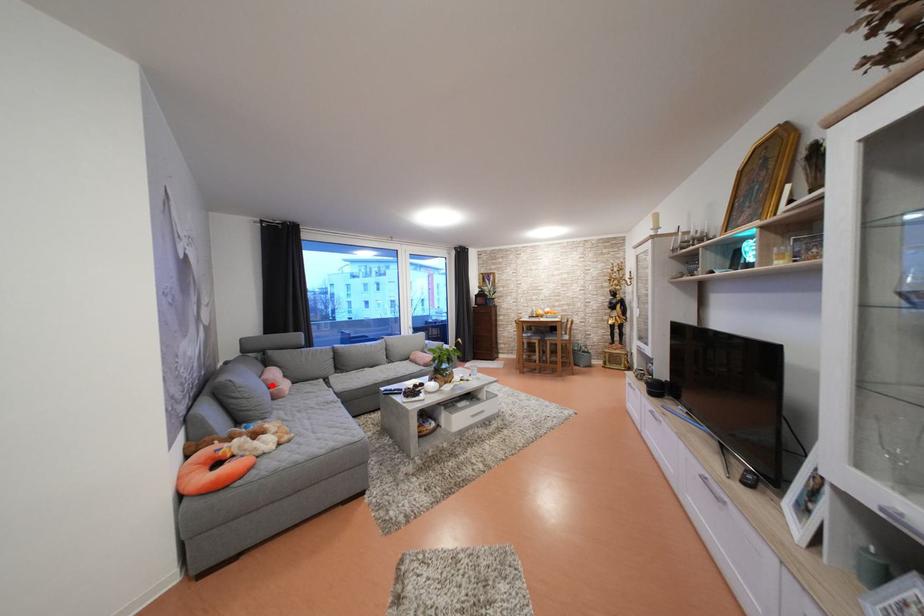
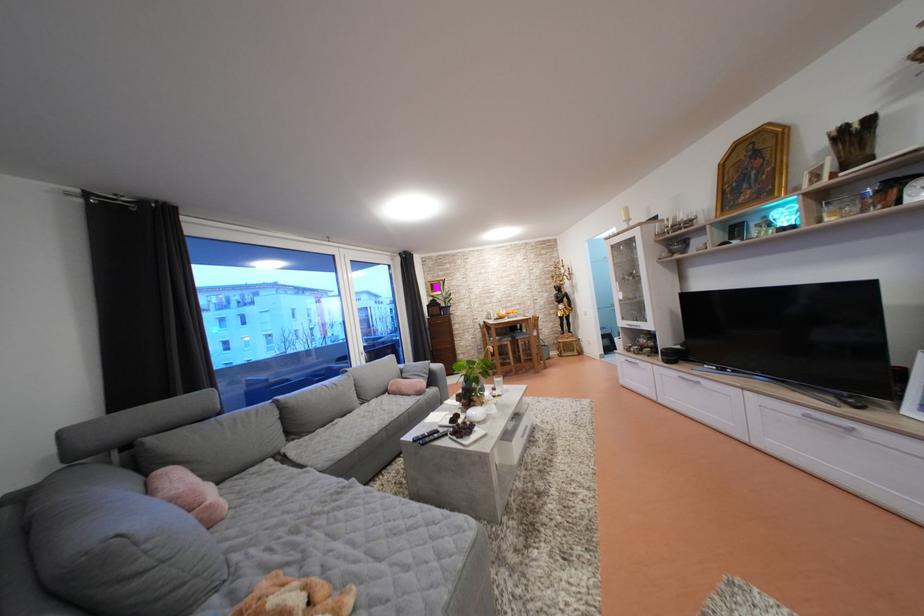
Find the pixel in the second image that matches the highlighted location in the first image.

(180, 505)